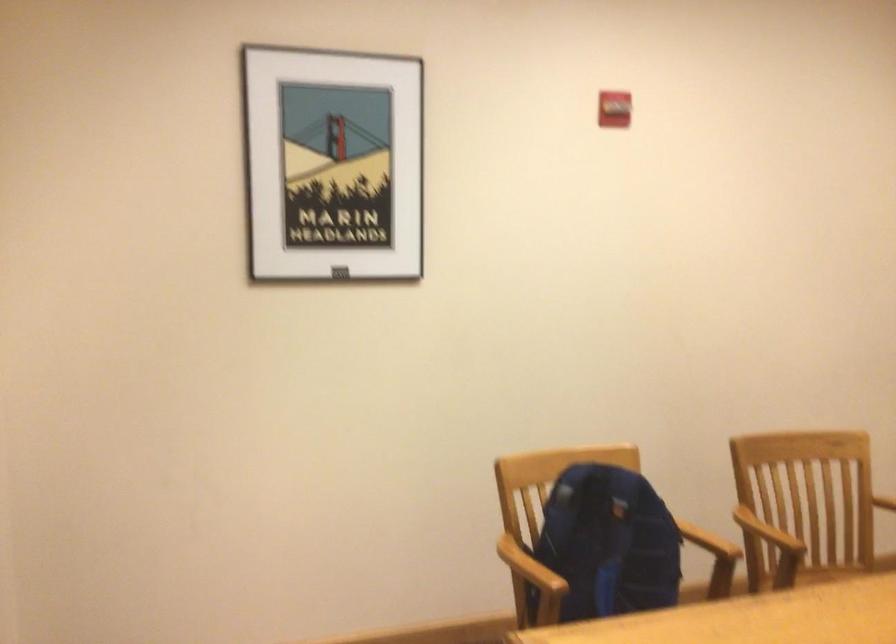
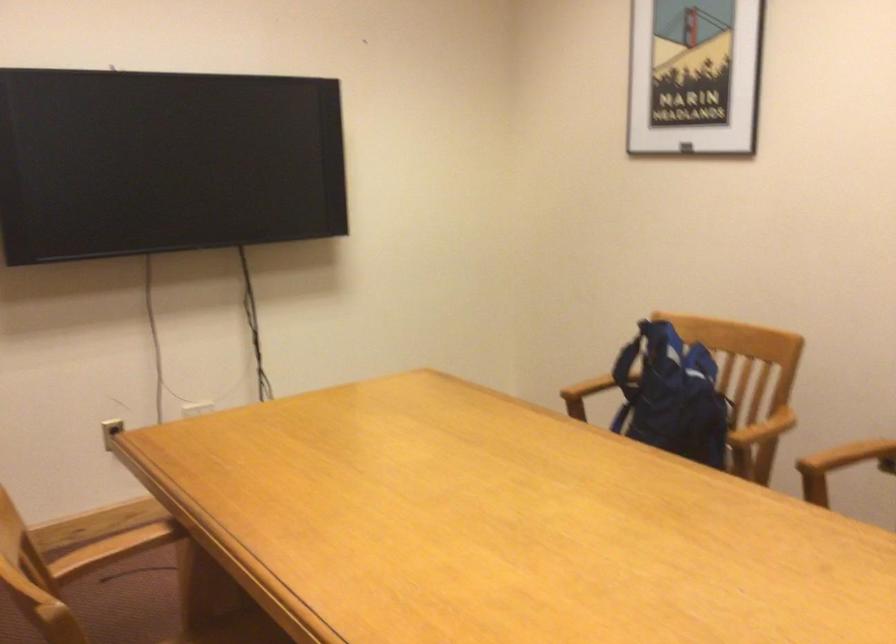
Find the pixel in the second image that matches point 685,534 in the first image.

(763, 428)